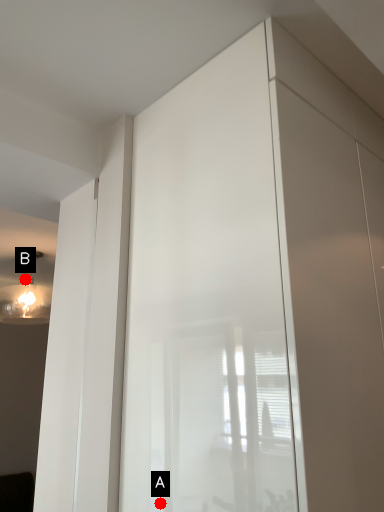
Question: Two points are circled on the image, labeled by A and B beside each circle. Which point is farther to the camera?

Choices:
 (A) A is further
 (B) B is further

Answer: (B)